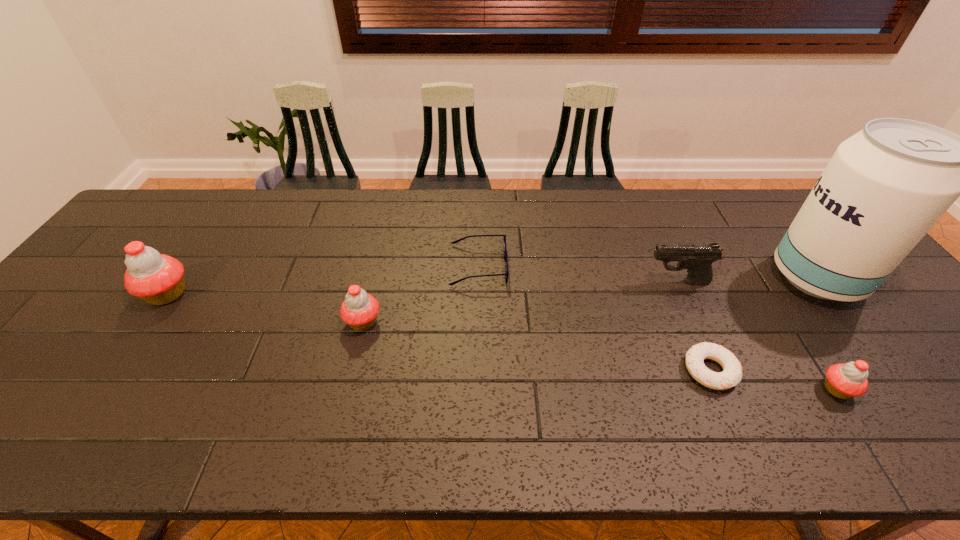
To achieve uniform spacing by inserting another cupcake among them, please point to a free space for this new cupcake. Please provide its 2D coordinates. Your answer should be formatted as a tuple, i.e. [(x, y)], where the tuple contains the x and y coordinates of a point satisfying the conditions above.

[(585, 354)]